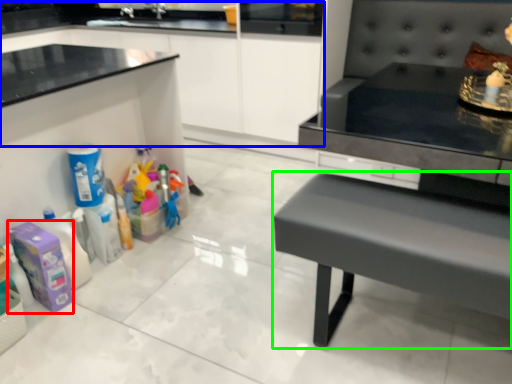
Question: Which object is the farthest from cleaning product (highlighted by a red box)? Choose among these: cabinetry (highlighted by a blue box) or table (highlighted by a green box).

Choices:
 (A) cabinetry
 (B) table

Answer: (A)